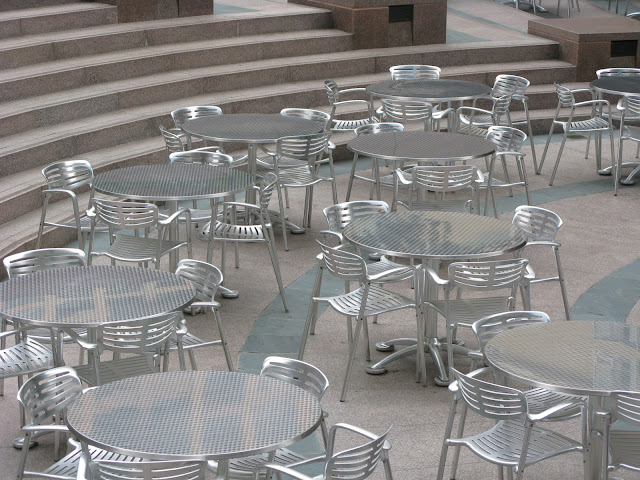
This screenshot has width=640, height=480. I want to click on table 8 chairs, so click(x=329, y=82), click(x=409, y=65), click(x=411, y=108), click(x=516, y=83).